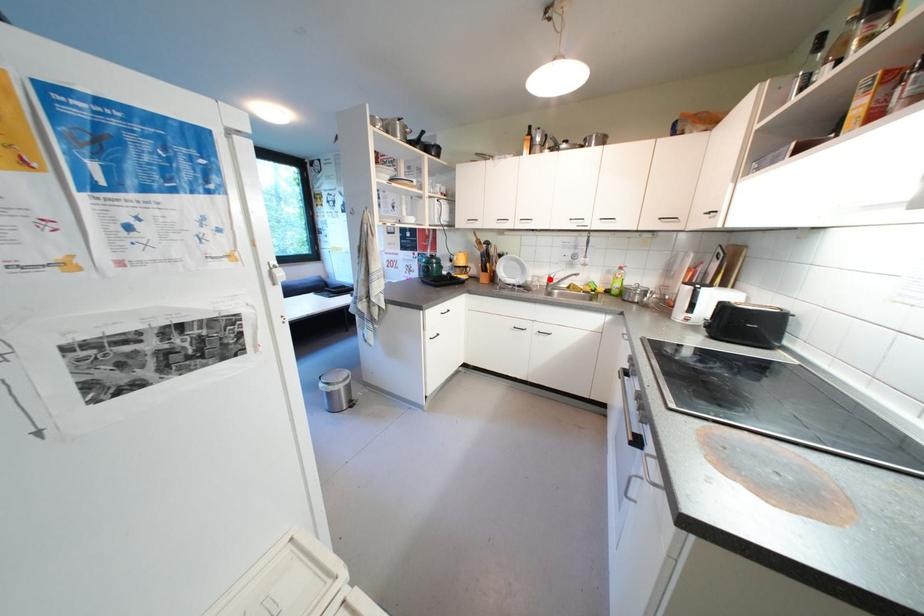
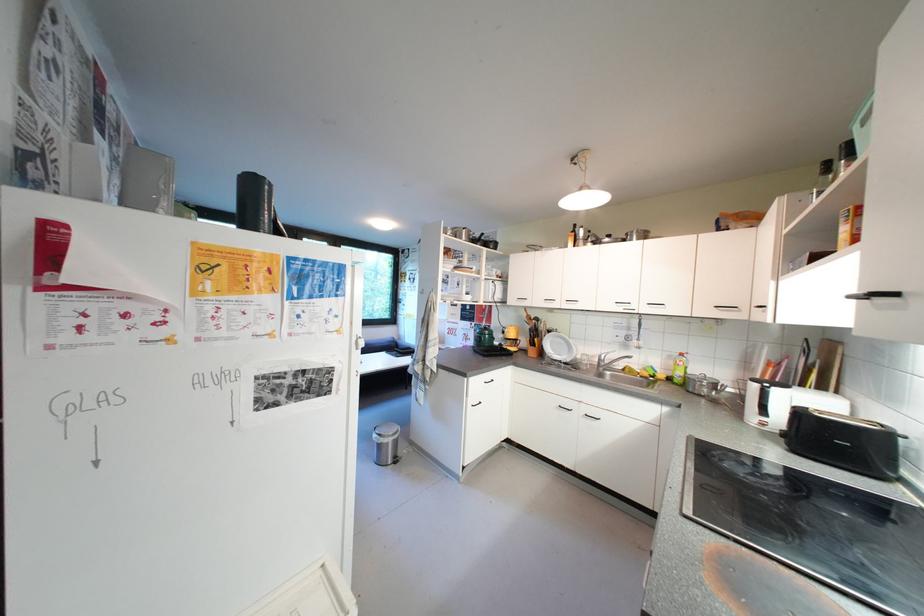
Question: I am providing you with two images of the same scene from different viewpoints. Image1 has a red point marked. In image2, the corresponding 3D location appears at what relative position? Reply with the corresponding letter.

Choices:
 (A) Closer
 (B) Farther

Answer: (B)